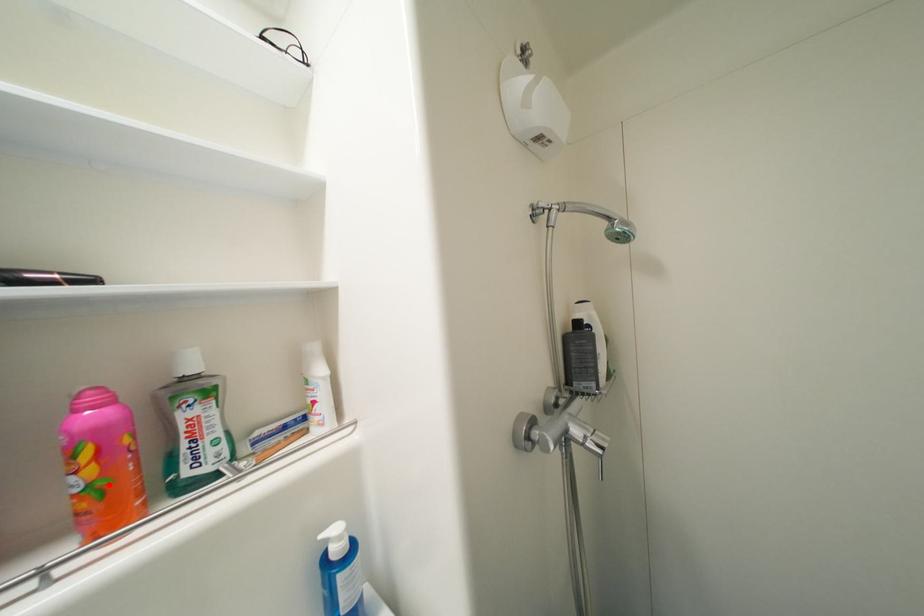
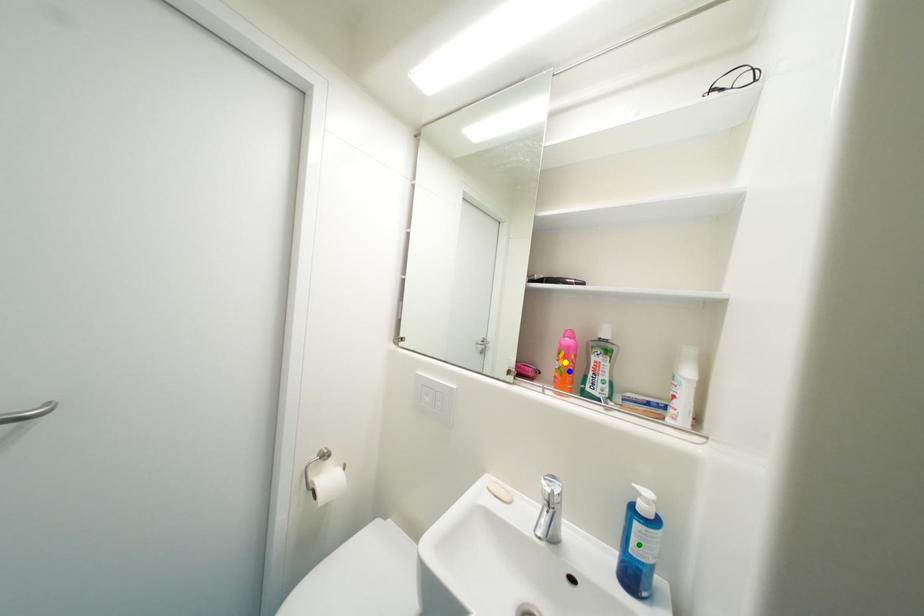
Question: I am providing you with two images of the same scene from different viewpoints. A red point is marked on the first image. You are given multiple points on the second image. Which mark in image 2 goes with the point in image 1?

Choices:
 (A) blue point
 (B) yellow point
 (C) green point

Answer: (A)